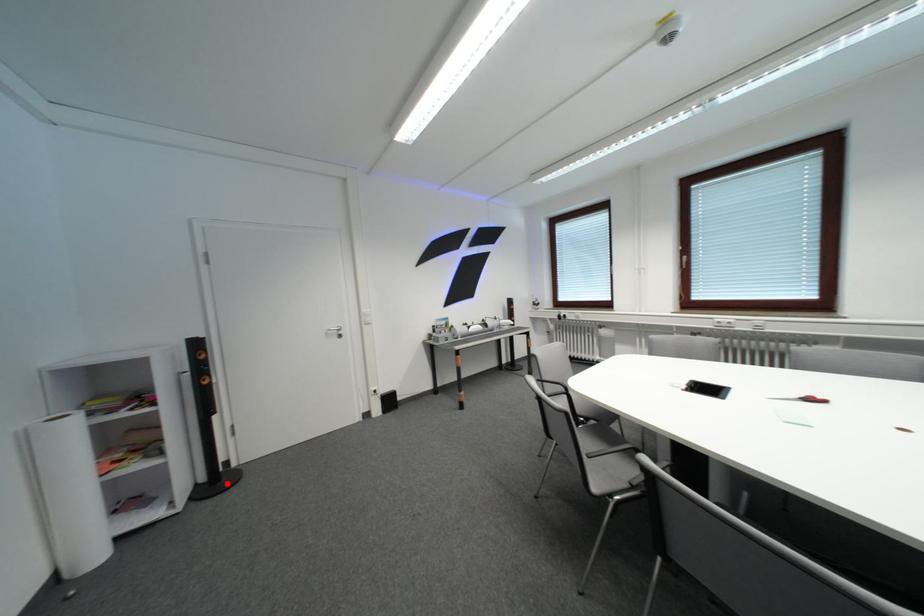
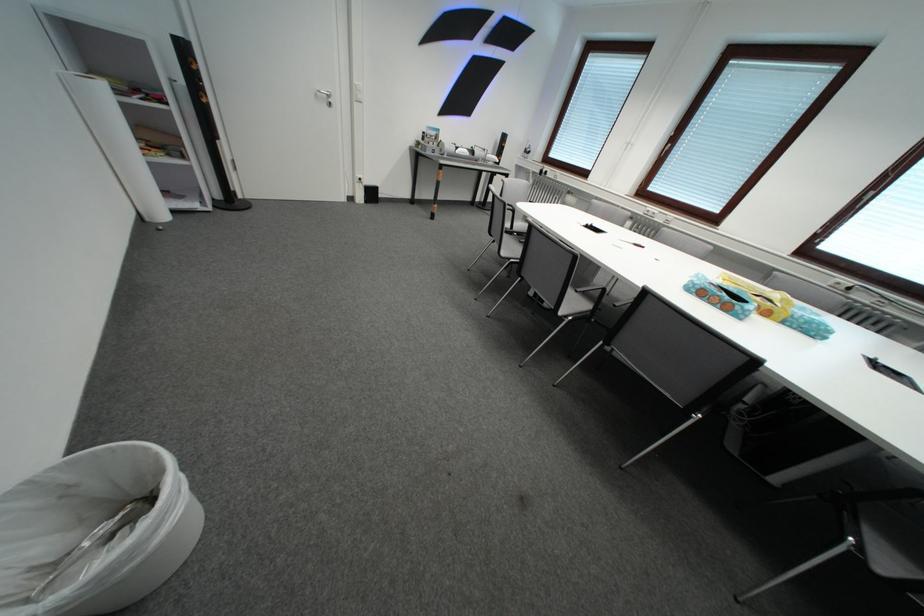
Question: I am providing you with two images of the same scene from different viewpoints. Given a red point in image1, look at the same physical point in image2. Is it:

Choices:
 (A) Closer to the viewpoint
 (B) Farther from the viewpoint

Answer: (A)